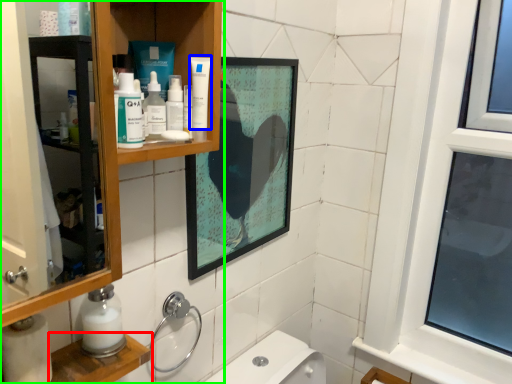
Question: Based on their relative distances, which object is farther from cabinet (highlighted by a red box)? Choose from toothpaste (highlighted by a blue box) and bathroom cabinet (highlighted by a green box).

Choices:
 (A) toothpaste
 (B) bathroom cabinet

Answer: (A)